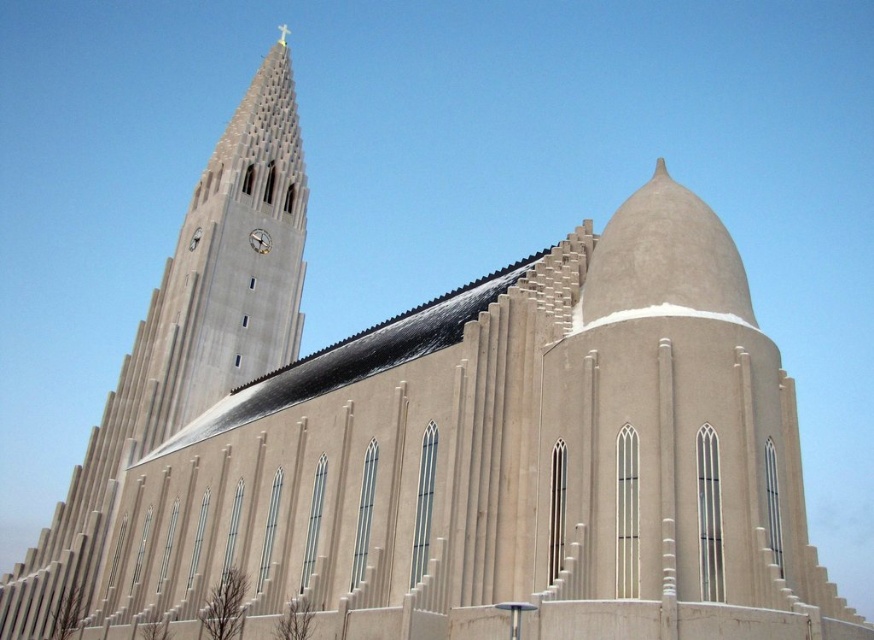
The width and height of the screenshot is (874, 640). What do you see at coordinates (186, 337) in the screenshot?
I see `smooth concrete tower at upper left` at bounding box center [186, 337].

Does smooth concrete tower at upper left have a larger size compared to metallic clock face at upper center?

Indeed, smooth concrete tower at upper left has a larger size compared to metallic clock face at upper center.

Which is in front, point (77, 490) or point (253, 228)?

Positioned in front is point (77, 490).

This screenshot has height=640, width=874. What are the coordinates of `smooth concrete tower at upper left` in the screenshot? It's located at (186, 337).